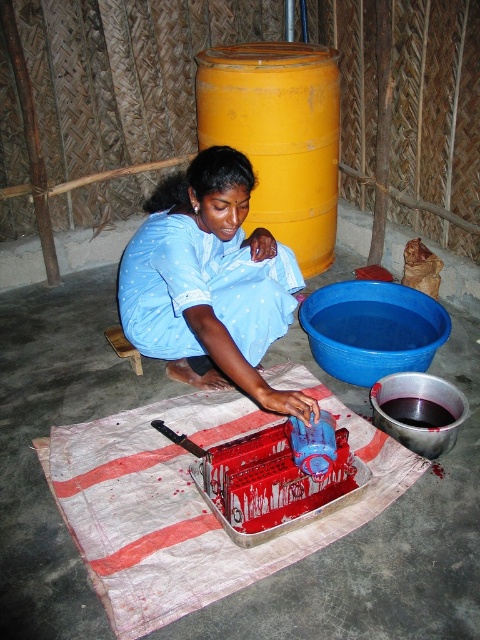
Where is the blue cotton fabric at center located in the image?

The blue cotton fabric at center is located at the point with coordinates 0.442 on the x axis and 0.438 on the y axis.

In the scene shown: You are standing in the room and notice a point marked at coordinates (207, 150). If you want to reach it without moving your feet, can you stretch your arm out to touch it?

The point at (207, 150) is 1.98 meters away from the camera, so if you can stretch your arm to that distance, you can touch it. However, most people cannot reach 1.98 meters without moving their feet.

The blue cotton fabric at center and the blue plastic basin at lower center are both in the scene. Which one is closer to the viewer?

The blue cotton fabric at center is closer to the viewer since it is in front of the blue plastic basin at lower center.